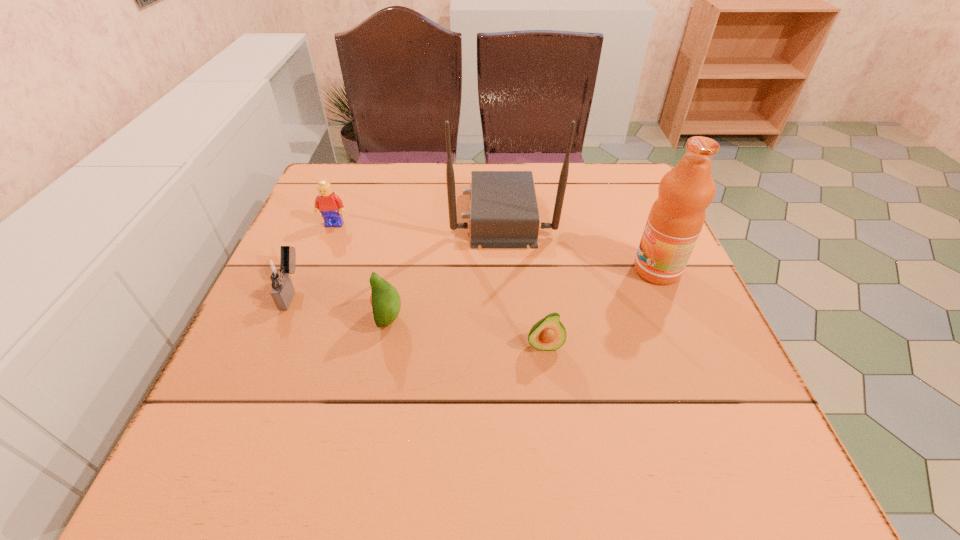
You are a GUI agent. You are given a task and a screenshot of the screen. Output one action in this format:
    pyautogui.click(x=<x>, y=<y>)
    Task: Click on the Lego that is at the left edge
    Image resolution: width=960 pixels, height=540 pixels.
    Given the screenshot: What is the action you would take?
    pyautogui.click(x=330, y=205)

At what (x,y) coordinates should I click in order to perform the action: click on igniter that is at the left edge. Please return your answer as a coordinate pair (x, y). Image resolution: width=960 pixels, height=540 pixels. Looking at the image, I should click on [x=278, y=271].

Find the location of `object at the right edge`. object at the right edge is located at coordinates (676, 218).

You are a GUI agent. You are given a task and a screenshot of the screen. Output one action in this format:
    pyautogui.click(x=<x>, y=<y>)
    Task: Click on the free space at the far edge of the desktop
    This screenshot has width=960, height=540.
    Given the screenshot: What is the action you would take?
    pyautogui.click(x=475, y=167)

Where is `vacant space at the near edge of the desktop`? This screenshot has height=540, width=960. vacant space at the near edge of the desktop is located at coordinates (633, 385).

You are a GUI agent. You are given a task and a screenshot of the screen. Output one action in this format:
    pyautogui.click(x=<x>, y=<y>)
    Task: Click on the vacant region at the left edge of the desktop
    The width and height of the screenshot is (960, 540).
    Given the screenshot: What is the action you would take?
    pyautogui.click(x=256, y=314)

Image resolution: width=960 pixels, height=540 pixels. What are the coordinates of `free space at the right edge` in the screenshot? It's located at (615, 253).

At what (x,y) coordinates should I click in order to perform the action: click on blank space at the far left corner. Please return your answer as a coordinate pair (x, y). Looking at the image, I should click on (374, 172).

The width and height of the screenshot is (960, 540). In order to click on vacant region at the near left corner of the desktop in this screenshot , I will do `click(233, 407)`.

Locate an element on the screen. The width and height of the screenshot is (960, 540). vacant region at the far right corner of the desktop is located at coordinates (594, 164).